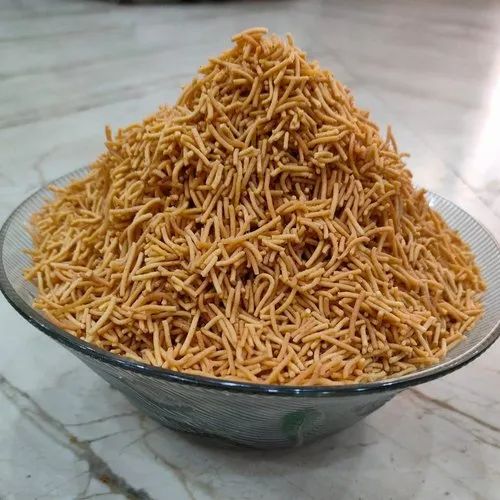
What are the coordinates of `stone countertop` in the screenshot? It's located at (417, 456).